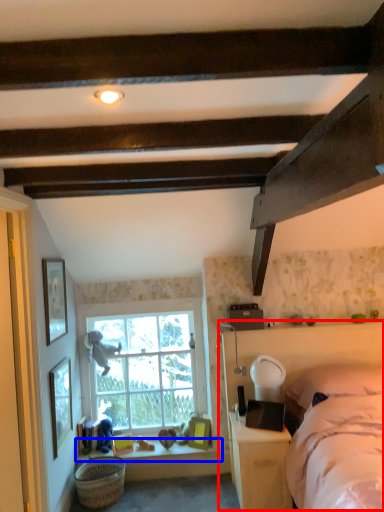
Question: Which point is further to the camera, bed frame (highlighted by a red box) or window sill (highlighted by a blue box)?

Choices:
 (A) bed frame
 (B) window sill

Answer: (B)